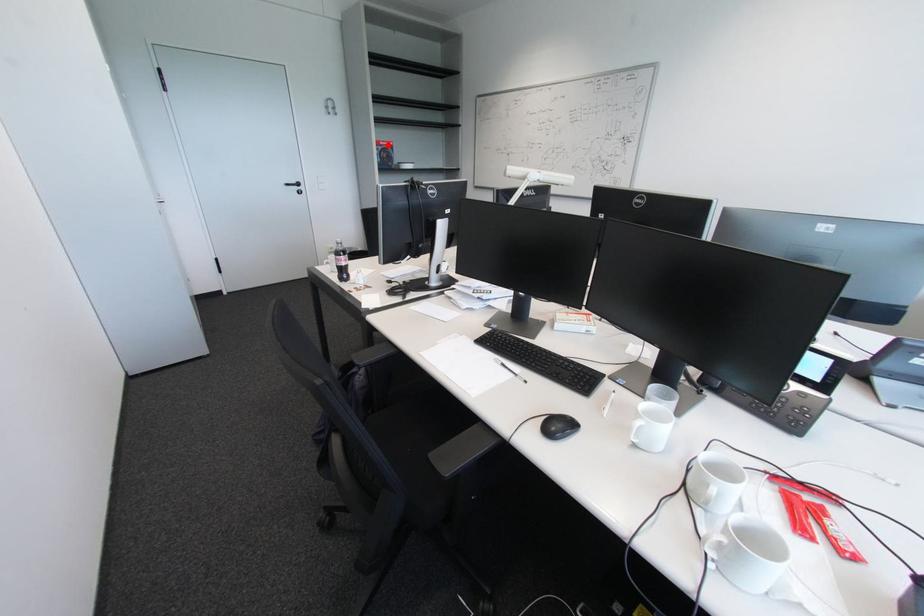
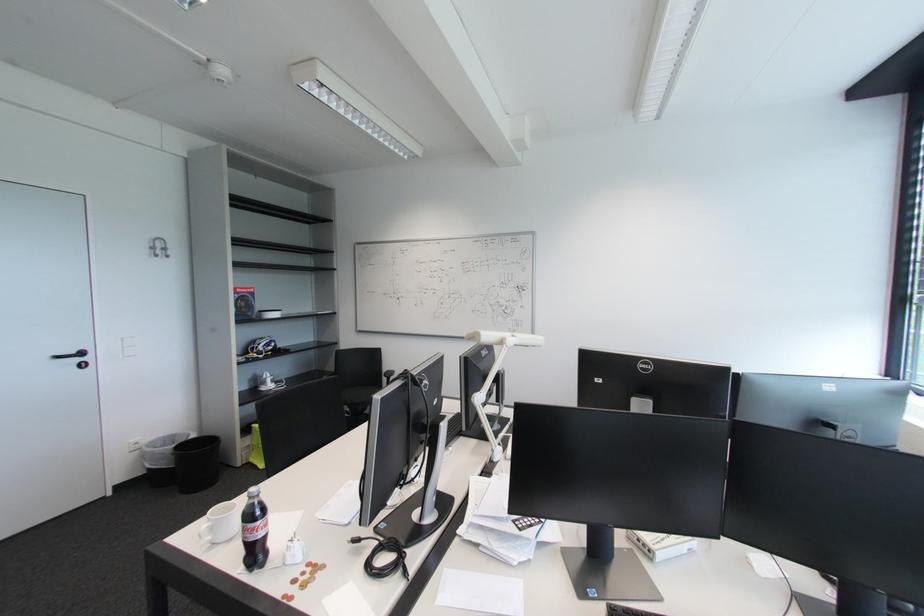
Where in the second image is the point corresponding to the highlighted location from the first image?

(246, 292)